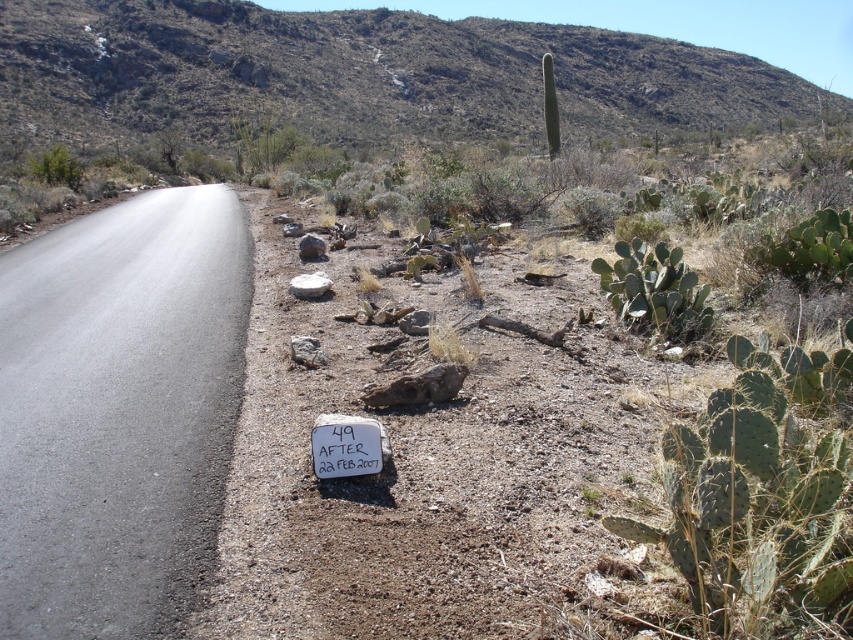
Question: Among these objects, which one is nearest to the camera?

Choices:
 (A) gray rock at center
 (B) gray rough rock at center
 (C) white smooth rock at center

Answer: (B)

Question: Which is farther from the gray rough rock at center?

Choices:
 (A) gray rock at center
 (B) white smooth rock at center
 (C) smooth gray rock at center
 (D) green spiny cactus at right

Answer: (C)

Question: Is green spiny cactus at upper center below gray rock at center?

Choices:
 (A) no
 (B) yes

Answer: (A)

Question: Observing the image, what is the correct spatial positioning of green spiny cactus at upper center in reference to gray rough rock at center?

Choices:
 (A) below
 (B) above

Answer: (B)

Question: Can you confirm if white plastic sign at lower center is positioned to the right of white smooth rock at center?

Choices:
 (A) yes
 (B) no

Answer: (A)

Question: Which of the following is the closest to the observer?

Choices:
 (A) gray rough rock at center
 (B) green spiny cactus at upper center
 (C) smooth gray rock at center
 (D) white plastic sign at lower center

Answer: (D)